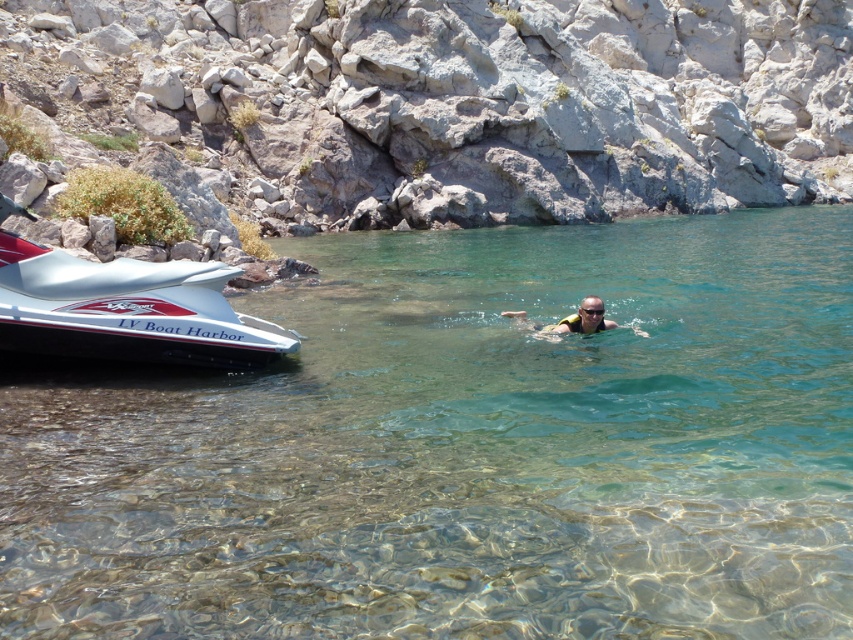
You are standing on the beach and see the silver metallic speedboat at left. If you want to swim to it, will you be able to reach it within 2 minutes if you swim at a speed of 1 meter per second?

The silver metallic speedboat at left is 9.87 meters away from the viewer. Swimming at 1 meter per second, it would take approximately 9.87 seconds to reach it, which is well within 2 minutes. Yes, you can reach it in time.

You are a snorkeler preparing to dive into the water. You see the gray rock at upper center and the transparent plastic goggles at center. Which object is closer to you as you look into the water?

The transparent plastic goggles at center are behind the gray rock at upper center, so the gray rock at upper center is closer to you.

You are a lifeguard on duty at the LV Boat Harbor jet ski. You notice a swimmer and some goggles in the water. Which object is closer to you, the tan skin swimmer at center or the transparent plastic goggles at center?

The tan skin swimmer at center is closer to you since it is positioned in front of the transparent plastic goggles at center.